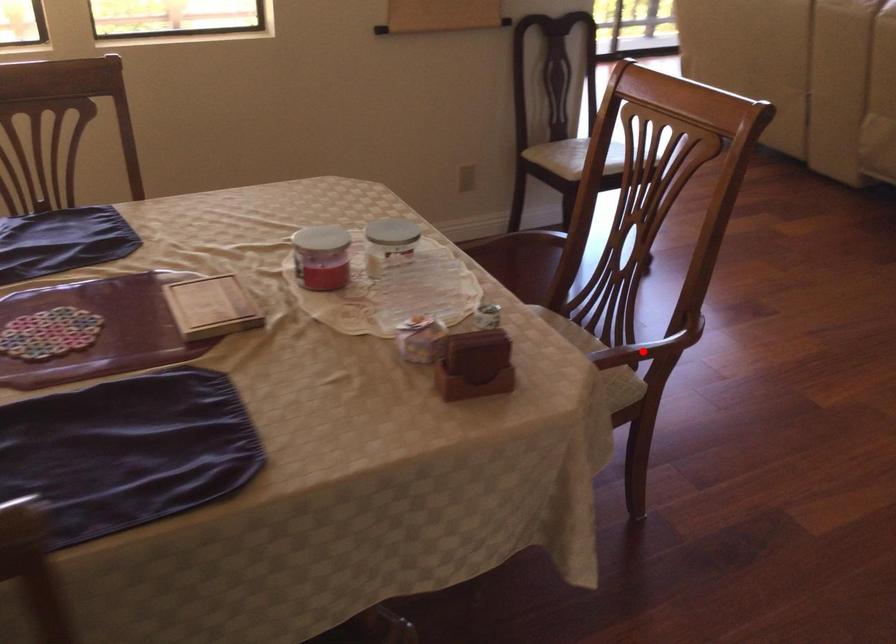
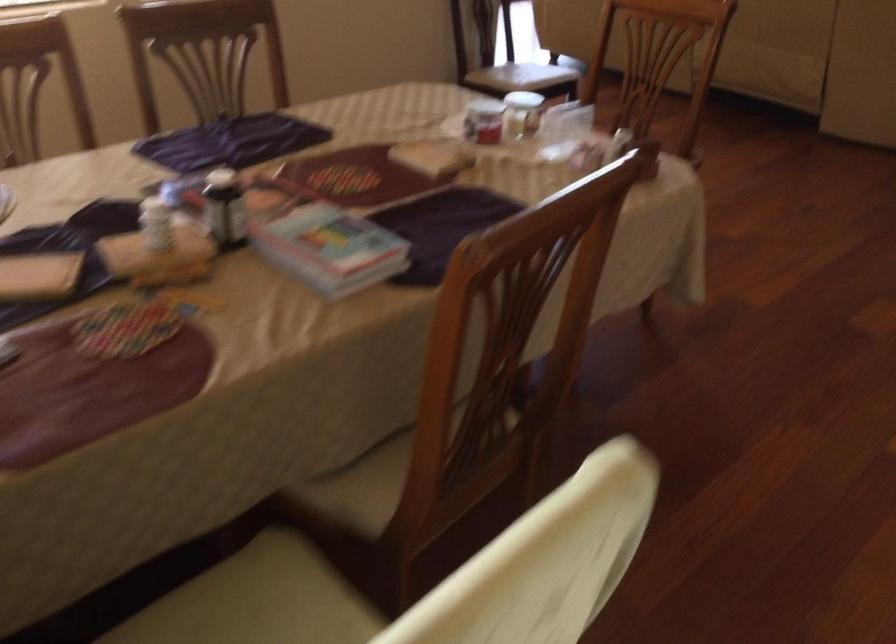
Question: I am providing you with two images of the same scene from different viewpoints. A red point is marked on the first image. Is the red point's position out of view in image 2?

Choices:
 (A) Yes
 (B) No

Answer: (A)